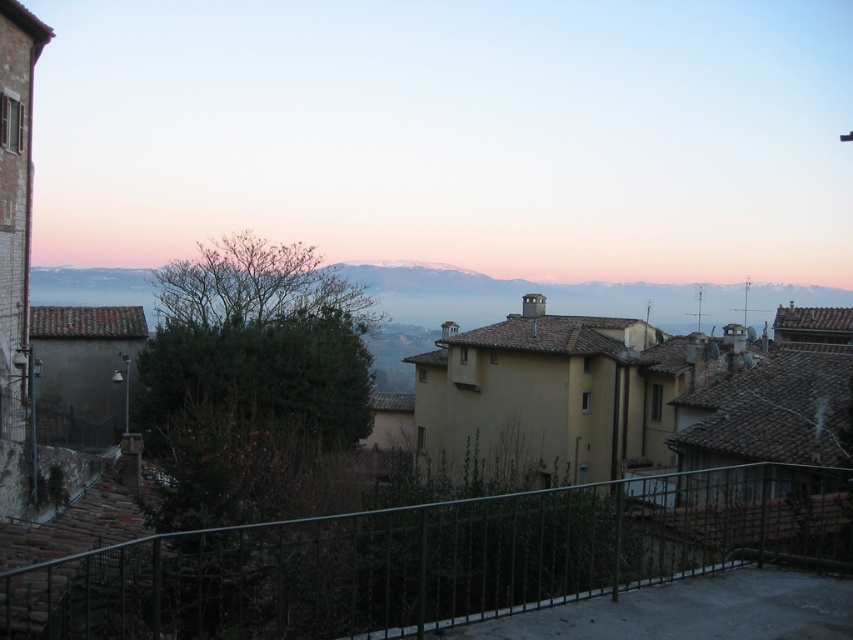
You are standing at the edge of the balcony and want to place a small potted plant that is 0.5 meters tall on the green metal fence at lower center. Can you estimate whether the fence is tall enough to prevent the plant from falling off?

The green metal fence at lower center is 5.12 meters away from the camera, but this distance does not indicate its height. The height of the fence is unknown, so it is impossible to determine if it can support the plant without falling.

You are standing on a balcony overlooking a hilly landscape. You see a green metal fence at lower center and a snowy mountain at upper center. Which object is positioned to the left when viewed from your perspective?

The green metal fence at lower center is positioned to the left of the snowy mountain at upper center.

You are standing at the camera position looking at the landscape. There is a point at coordinates point (212, 540). If you want to place a small flag exactly at that point, how far in feet should you walk forward from your current position to reach it?

The point (212, 540) is 28.12 feet from the camera, so you should walk forward 28.12 feet to reach it.